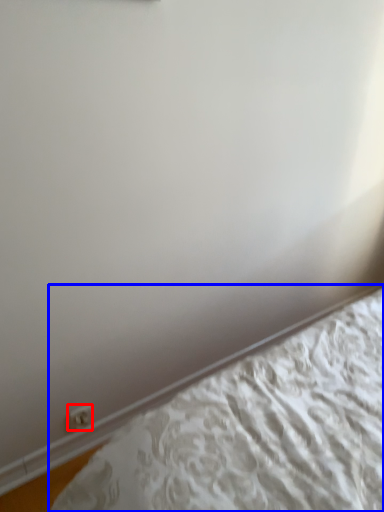
Question: Among these objects, which one is farthest to the camera, electric outlet (highlighted by a red box) or bed (highlighted by a blue box)?

Choices:
 (A) electric outlet
 (B) bed

Answer: (A)